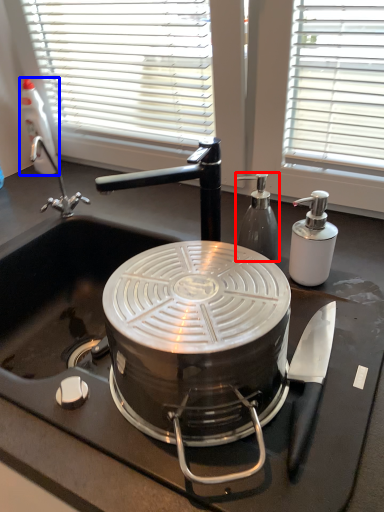
Question: Which object is further to the camera taking this photo, kitchen appliance (highlighted by a red box) or bottle (highlighted by a blue box)?

Choices:
 (A) kitchen appliance
 (B) bottle

Answer: (B)